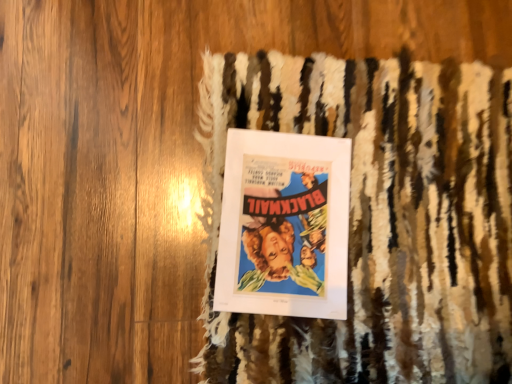
At what (x,y) coordinates should I click in order to perform the action: click on vacant space to the right of vibrant paper poster at center. Please return your answer as a coordinate pair (x, y). Looking at the image, I should click on (409, 256).